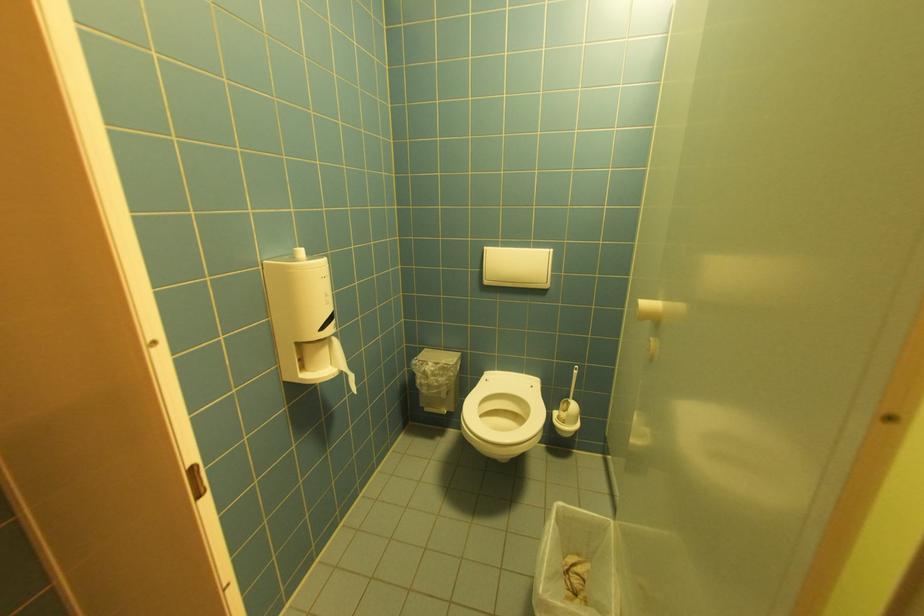
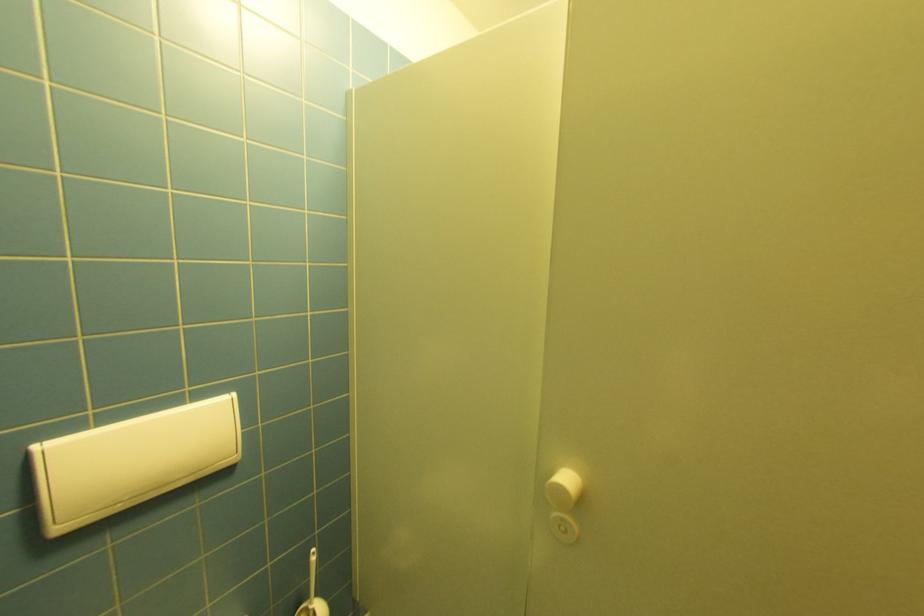
In the second image, find the point that corresponds to (492,283) in the first image.

(66, 530)